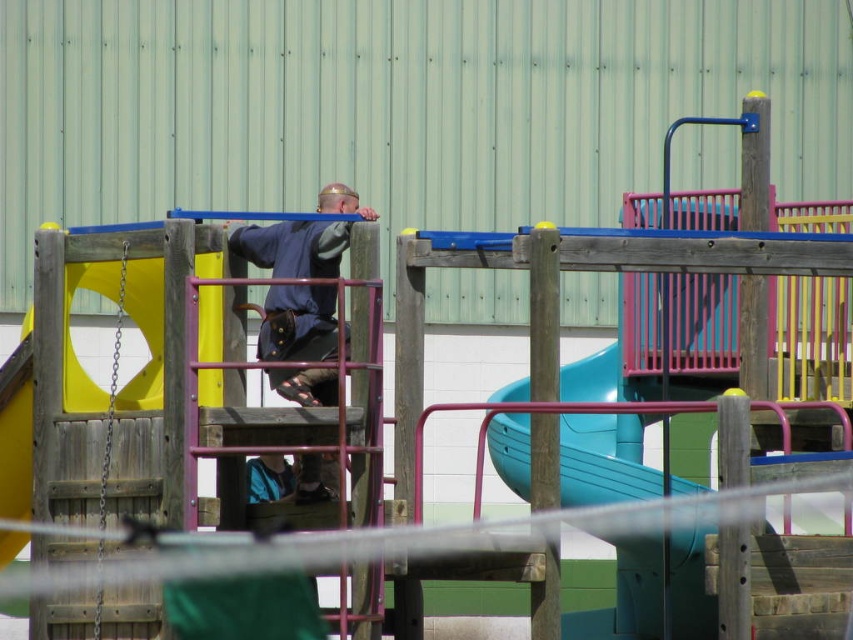
Does point (265, 371) lie behind point (280, 496)?

No, (265, 371) is in front of (280, 496).

Does dark blue fabric shirt at center appear over blue fabric pants at lower center?

Yes, dark blue fabric shirt at center is above blue fabric pants at lower center.

Locate an element on the screen. The width and height of the screenshot is (853, 640). dark blue fabric shirt at center is located at coordinates (292, 248).

Can you confirm if metallic chain swing at left is positioned above blue fabric pants at lower center?

Yes.

Which is below, metallic chain swing at left or blue fabric pants at lower center?

blue fabric pants at lower center

Between point (102, 516) and point (289, 468), which one is positioned behind?

Point (289, 468)

You are a GUI agent. You are given a task and a screenshot of the screen. Output one action in this format:
    pyautogui.click(x=<x>, y=<y>)
    Task: Click on the metallic chain swing at left
    This screenshot has width=853, height=640.
    Given the screenshot: What is the action you would take?
    pyautogui.click(x=112, y=390)

Which is more to the right, dark blue fabric shirt at center or metallic chain swing at left?

dark blue fabric shirt at center is more to the right.

Is the position of dark blue fabric shirt at center less distant than that of metallic chain swing at left?

That is False.

What do you see at coordinates (292, 248) in the screenshot? The width and height of the screenshot is (853, 640). I see `dark blue fabric shirt at center` at bounding box center [292, 248].

Locate an element on the screen. dark blue fabric shirt at center is located at coordinates (292, 248).